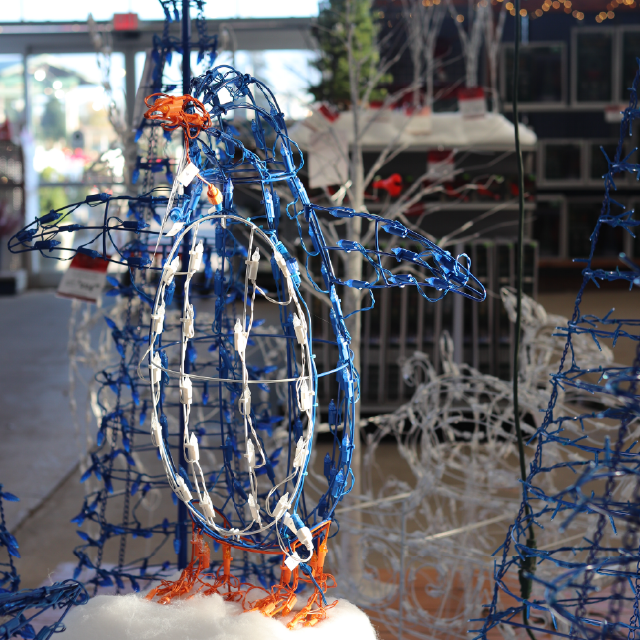
This screenshot has width=640, height=640. Identify the location of plant. (337, 83).